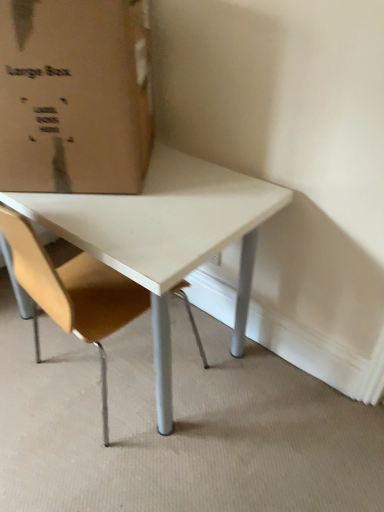
Question: Considering the positions of point (36, 58) and point (61, 269), is point (36, 58) closer or farther from the camera than point (61, 269)?

Choices:
 (A) closer
 (B) farther

Answer: (A)

Question: From the image's perspective, is brown cardboard box at upper left located above or below light brown leather chair at center?

Choices:
 (A) above
 (B) below

Answer: (A)

Question: From a real-world perspective, relative to light brown leather chair at center, is brown cardboard box at upper left vertically above or below?

Choices:
 (A) above
 (B) below

Answer: (A)

Question: From their relative heights in the image, would you say light brown leather chair at center is taller or shorter than brown cardboard box at upper left?

Choices:
 (A) tall
 (B) short

Answer: (A)

Question: Relative to brown cardboard box at upper left, is light brown leather chair at center in front or behind?

Choices:
 (A) behind
 (B) front

Answer: (B)

Question: From the image's perspective, is light brown leather chair at center located above or below brown cardboard box at upper left?

Choices:
 (A) below
 (B) above

Answer: (A)

Question: Does point pyautogui.click(x=109, y=328) appear closer or farther from the camera than point pyautogui.click(x=72, y=29)?

Choices:
 (A) closer
 (B) farther

Answer: (B)